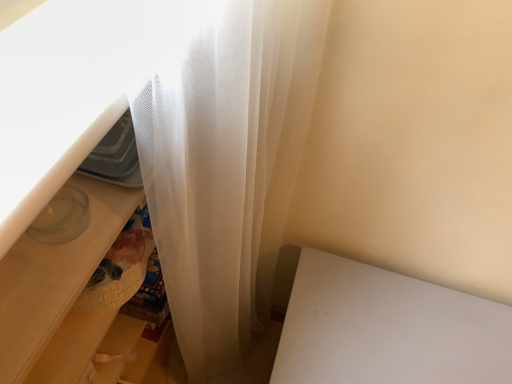
Question: Is white matte table at lower right positioned beyond the bounds of translucent plastic drawer at lower left?

Choices:
 (A) no
 (B) yes

Answer: (B)

Question: Considering the relative sizes of white matte table at lower right and translucent plastic drawer at lower left in the image provided, is white matte table at lower right taller than translucent plastic drawer at lower left?

Choices:
 (A) yes
 (B) no

Answer: (B)

Question: From a real-world perspective, is white matte table at lower right over translucent plastic drawer at lower left?

Choices:
 (A) no
 (B) yes

Answer: (A)

Question: Is white matte table at lower right oriented towards translucent plastic drawer at lower left?

Choices:
 (A) yes
 (B) no

Answer: (B)

Question: Does white matte table at lower right have a lesser width compared to translucent plastic drawer at lower left?

Choices:
 (A) yes
 (B) no

Answer: (B)

Question: Can you confirm if white matte table at lower right is wider than translucent plastic drawer at lower left?

Choices:
 (A) no
 (B) yes

Answer: (B)

Question: From a real-world perspective, is translucent plastic drawer at lower left on white matte table at lower right?

Choices:
 (A) yes
 (B) no

Answer: (A)

Question: Is translucent plastic drawer at lower left not within white matte table at lower right?

Choices:
 (A) no
 (B) yes

Answer: (B)

Question: Is translucent plastic drawer at lower left aimed at white matte table at lower right?

Choices:
 (A) no
 (B) yes

Answer: (B)

Question: Is translucent plastic drawer at lower left next to white matte table at lower right and touching it?

Choices:
 (A) no
 (B) yes

Answer: (A)

Question: Is translucent plastic drawer at lower left oriented away from white matte table at lower right?

Choices:
 (A) yes
 (B) no

Answer: (B)

Question: Is translucent plastic drawer at lower left behind white matte table at lower right?

Choices:
 (A) yes
 (B) no

Answer: (B)

Question: In terms of height, does white matte table at lower right look taller or shorter compared to translucent plastic drawer at lower left?

Choices:
 (A) short
 (B) tall

Answer: (A)